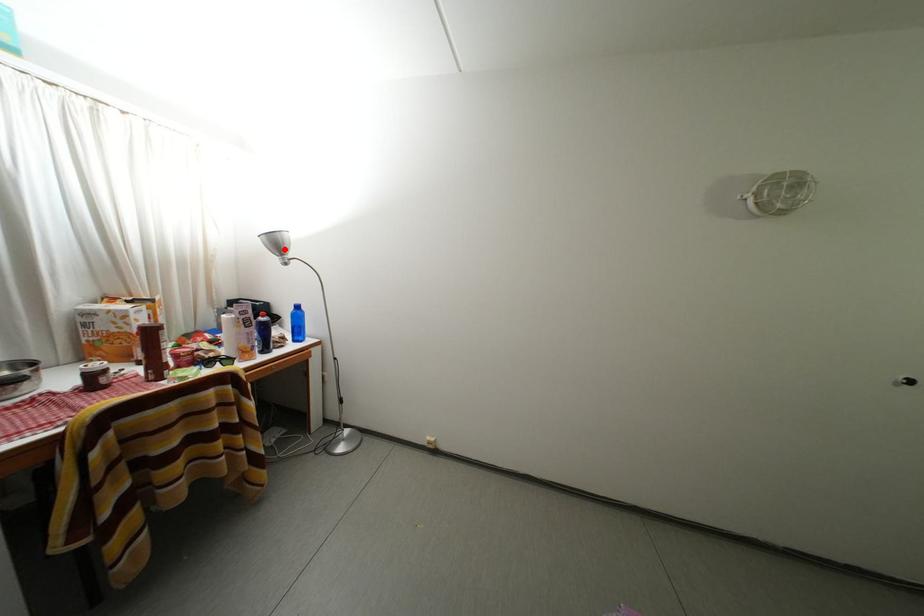
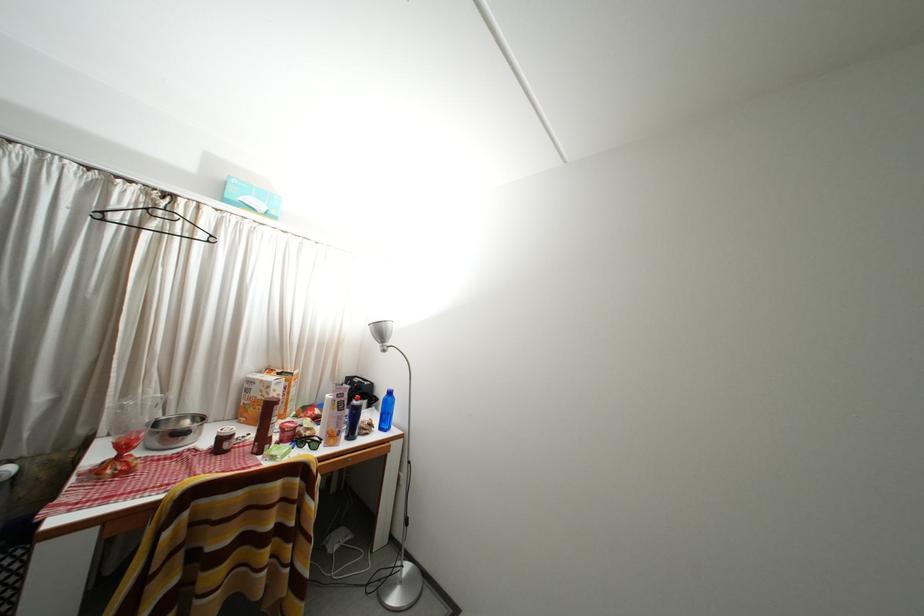
Find the pixel in the second image that matches the highlighted location in the first image.

(388, 338)